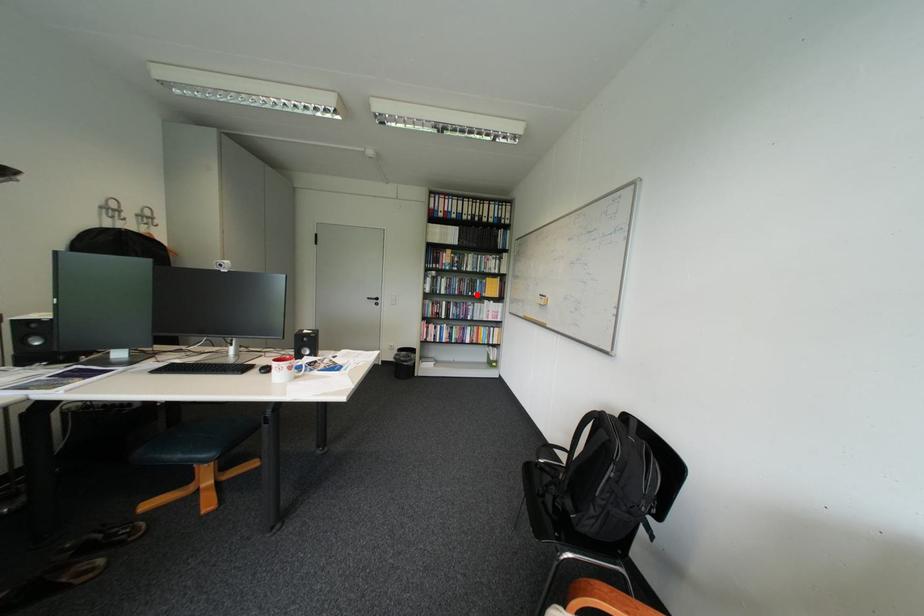
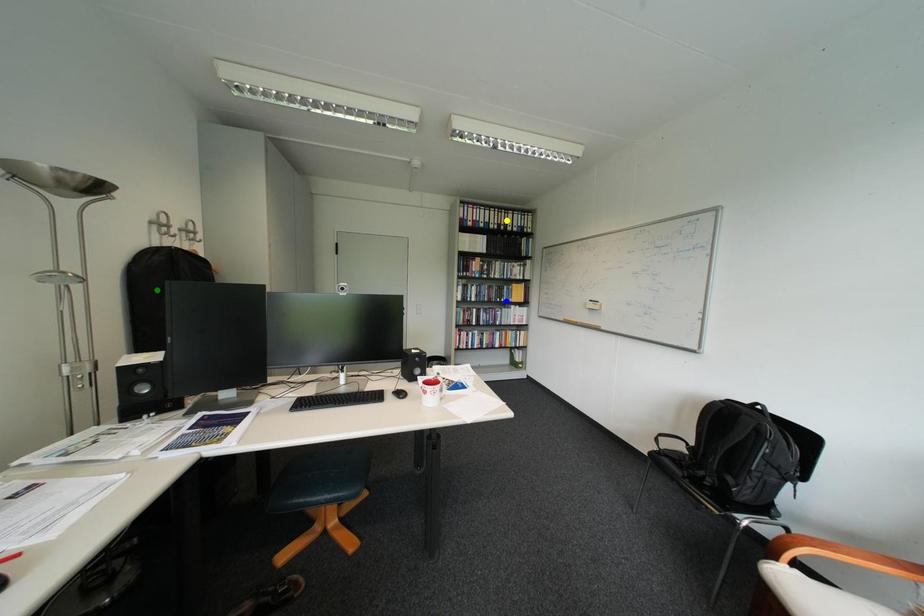
Question: I am providing you with two images of the same scene from different viewpoints. A red point is marked on the first image. You are given multiple points on the second image. Which point in image 2 is actually the same real-world point as the red point in image 1?

Choices:
 (A) yellow point
 (B) green point
 (C) blue point

Answer: (C)